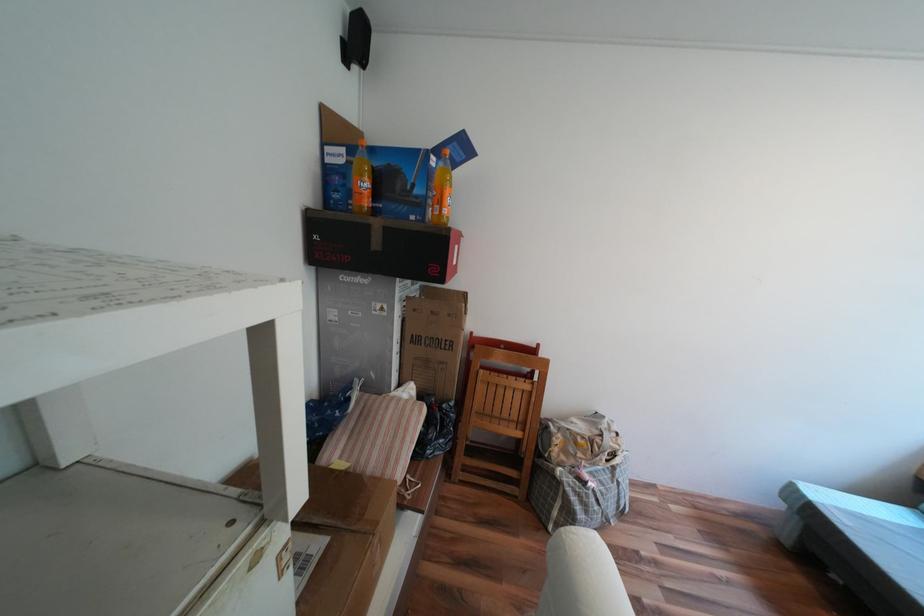
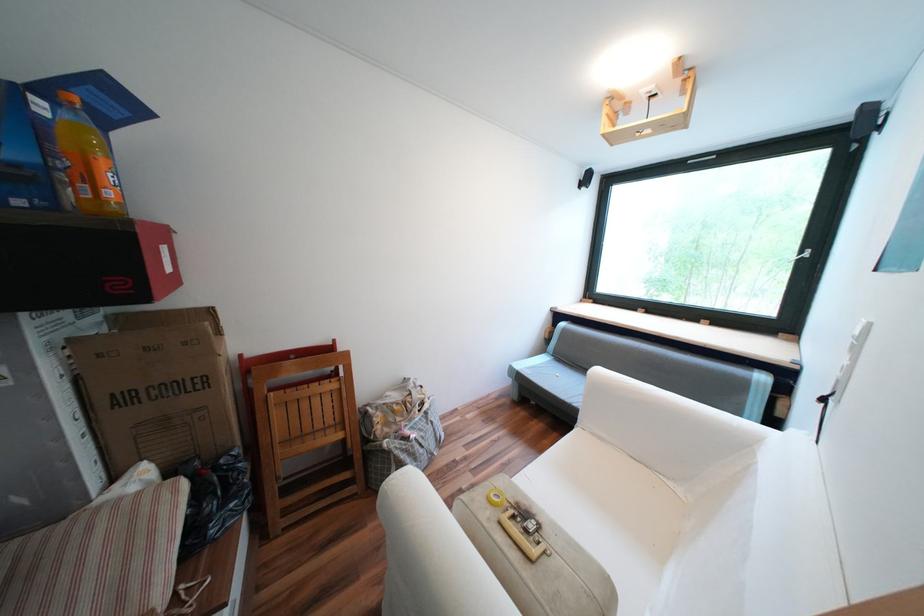
The point at (801, 488) is marked in the first image. Where is the corresponding point in the second image?

(520, 369)